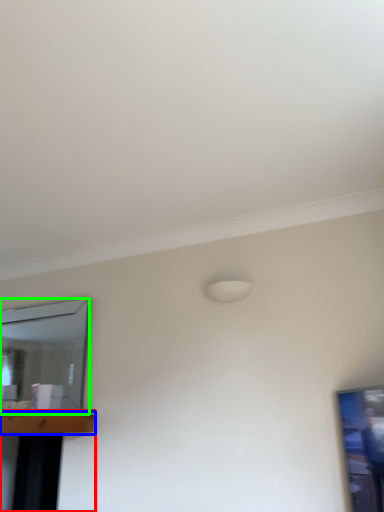
Question: Based on their relative distances, which object is nearer to table (highlighted by a red box)? Choose from table (highlighted by a blue box) and mirror (highlighted by a green box).

Choices:
 (A) table
 (B) mirror

Answer: (A)